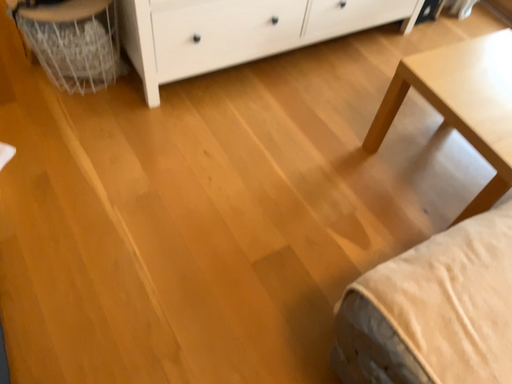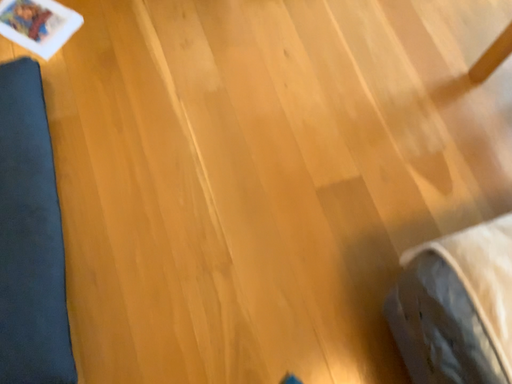
Question: Which way did the camera rotate in the video?

Choices:
 (A) rotated downward
 (B) rotated upward

Answer: (A)